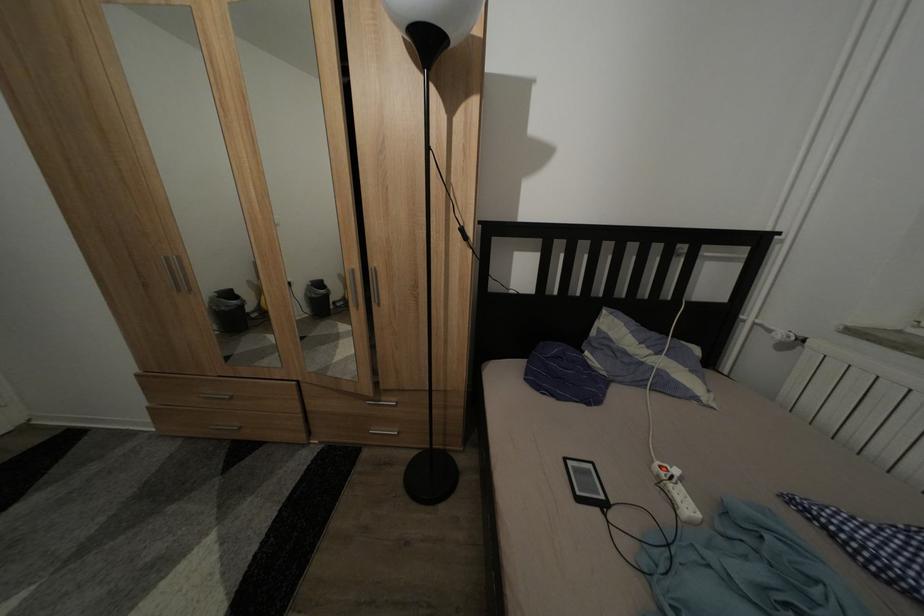
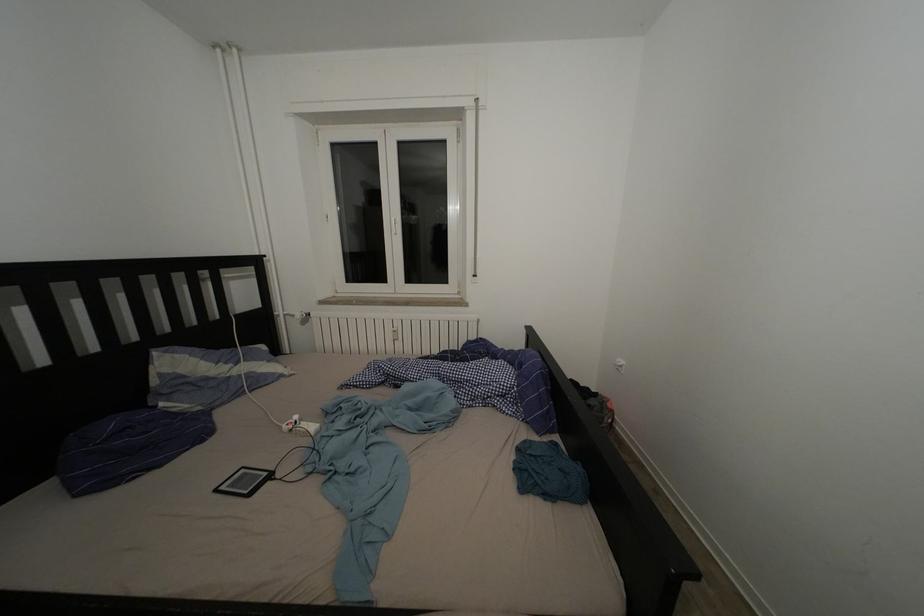
Question: The images are taken continuously from a first-person perspective. In which direction is your viewpoint rotating?

Choices:
 (A) Left
 (B) Right
 (C) Up
 (D) Down

Answer: (B)